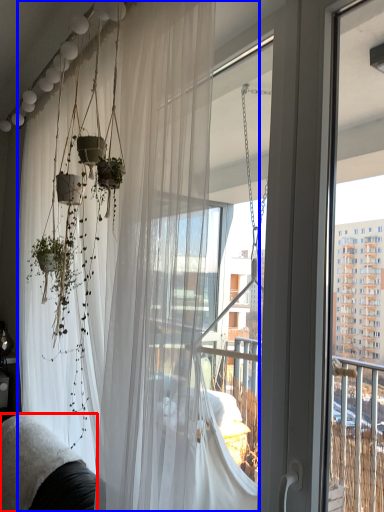
Question: Which object appears farthest to the camera in this image, couch (highlighted by a red box) or curtain (highlighted by a blue box)?

Choices:
 (A) couch
 (B) curtain

Answer: (A)